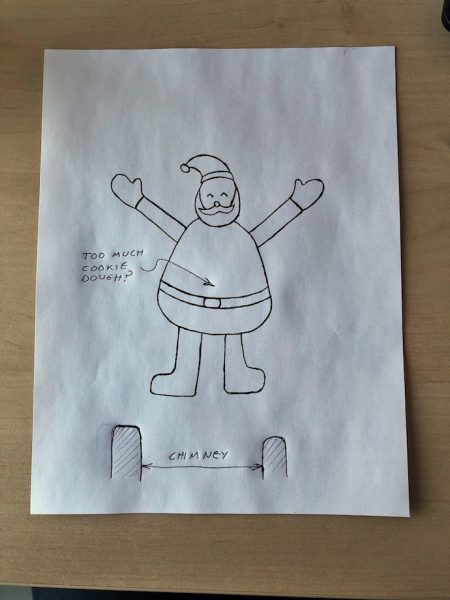
I want to click on wooden table, so click(292, 548).